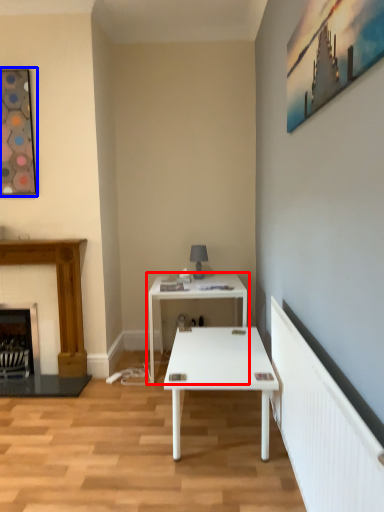
Question: Which point is further to the camera, table (highlighted by a red box) or picture frame (highlighted by a blue box)?

Choices:
 (A) table
 (B) picture frame

Answer: (A)